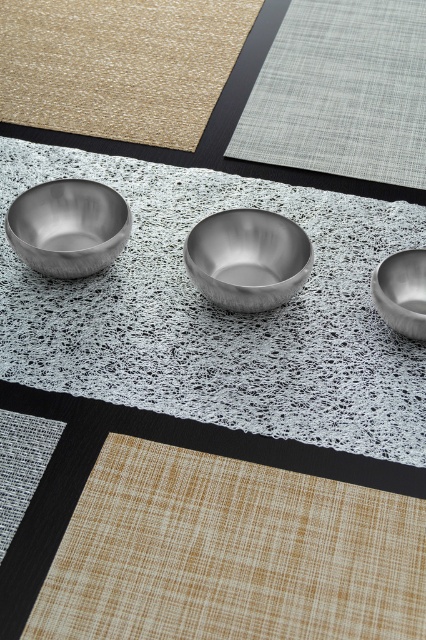
Question: Does light gray woven mat at upper center have a smaller size compared to brushed metal bowl at left?

Choices:
 (A) no
 (B) yes

Answer: (A)

Question: Is beige woven mat at lower left bigger than polished silver bowl at right?

Choices:
 (A) no
 (B) yes

Answer: (B)

Question: Does brushed metal bowl at center appear under polished silver bowl at right?

Choices:
 (A) yes
 (B) no

Answer: (B)

Question: Which of the following is the farthest from the observer?

Choices:
 (A) [175, 596]
 (B) [77, 211]

Answer: (B)

Question: Among these points, which one is farthest from the camera?

Choices:
 (A) (253, 244)
 (B) (158, 300)

Answer: (A)

Question: Which of the following is the closest to the observer?

Choices:
 (A) brushed metal bowl at left
 (B) light gray woven mat at upper center

Answer: (A)